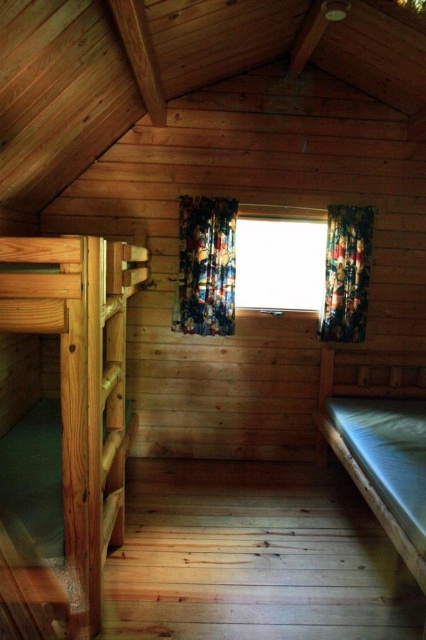
Can you confirm if transparent glass window at center is shorter than multicolored fabric curtain at center?

Yes, transparent glass window at center is shorter than multicolored fabric curtain at center.

Is transparent glass window at center smaller than multicolored fabric curtain at center?

No, transparent glass window at center is not smaller than multicolored fabric curtain at center.

Between point (319, 266) and point (196, 273), which one is positioned in front?

Point (196, 273)

Identify the location of transparent glass window at center. (279, 264).

Is white fabric bed at right below floral fabric curtain at right?

Indeed, white fabric bed at right is positioned under floral fabric curtain at right.

Is white fabric bed at right thinner than floral fabric curtain at right?

In fact, white fabric bed at right might be wider than floral fabric curtain at right.

Measure the distance between white fabric bed at right and camera.

white fabric bed at right and camera are 6.48 feet apart.

Where is `white fabric bed at right`? white fabric bed at right is located at coordinates (380, 442).

Is white fabric bed at right closer to the viewer compared to multicolored fabric curtain at center?

That is True.

At what (x,y) coordinates should I click in order to perform the action: click on white fabric bed at right. Please return your answer as a coordinate pair (x, y). The image size is (426, 640). Looking at the image, I should click on (380, 442).

You are a GUI agent. You are given a task and a screenshot of the screen. Output one action in this format:
    pyautogui.click(x=<x>, y=<y>)
    Task: Click on the white fabric bed at right
    
    Given the screenshot: What is the action you would take?
    pyautogui.click(x=380, y=442)

At what (x,y) coordinates should I click in order to perform the action: click on white fabric bed at right. Please return your answer as a coordinate pair (x, y). Looking at the image, I should click on (380, 442).